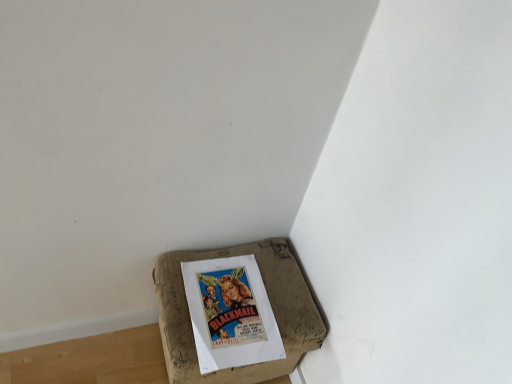
The image size is (512, 384). What are the coordinates of `vacant point above vintage paper poster at bottom corner (from a real-world perspective)` in the screenshot? It's located at (232, 304).